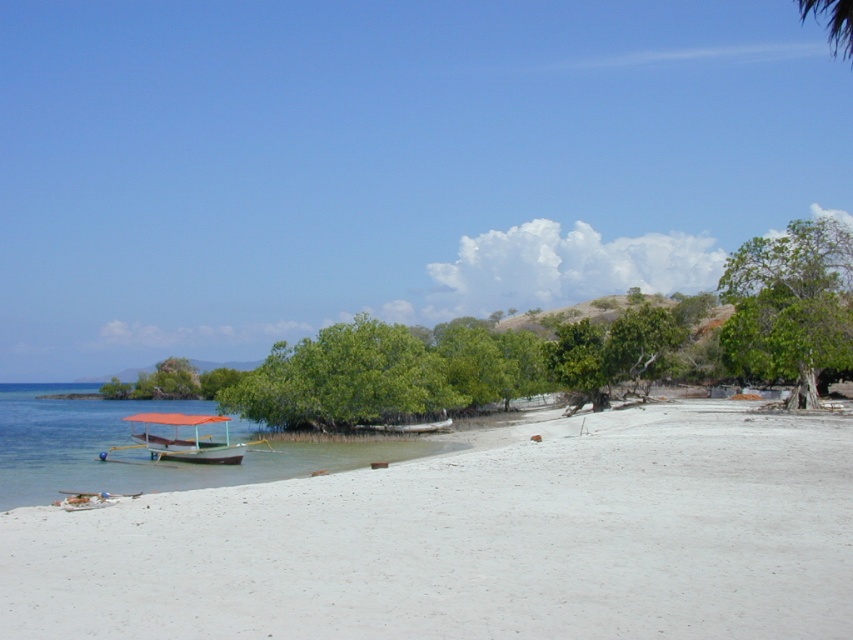
Question: Can you confirm if white sandy beach at lower left is positioned to the left of green leafy tree at right?

Choices:
 (A) no
 (B) yes

Answer: (B)

Question: Which point is closer to the camera?

Choices:
 (A) green leafy tree at center
 (B) clear water at lower left
 (C) white matte boat at center

Answer: (B)

Question: Estimate the real-world distances between objects in this image. Which object is closer to the clear water at lower left?

Choices:
 (A) green leafy tree at right
 (B) white matte boat at center

Answer: (B)

Question: Can you confirm if white sandy beach at lower left is thinner than green leafy tree at center?

Choices:
 (A) no
 (B) yes

Answer: (B)

Question: Based on their relative distances, which object is nearer to the green leafy tree at right?

Choices:
 (A) green leafy tree at center
 (B) white matte boat at center
 (C) white sandy beach at lower left
 (D) orange fabric boat at lower left

Answer: (B)

Question: Observing the image, what is the correct spatial positioning of white sandy beach at lower left in reference to green leafy tree at right?

Choices:
 (A) below
 (B) above

Answer: (A)